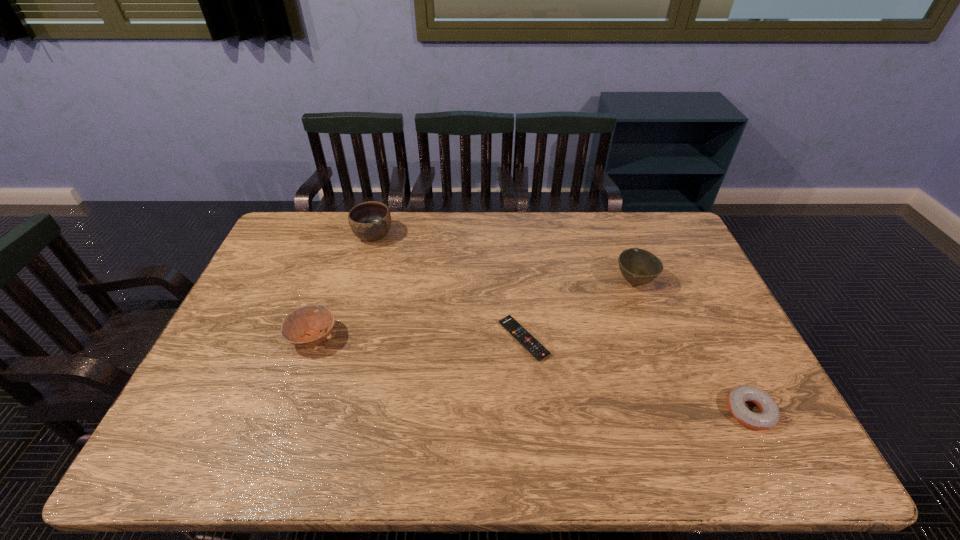
Where is `the farthest object`? This screenshot has height=540, width=960. the farthest object is located at coordinates (370, 221).

Where is `the second farthest bowl`? The width and height of the screenshot is (960, 540). the second farthest bowl is located at coordinates [x=638, y=266].

You are a GUI agent. You are given a task and a screenshot of the screen. Output one action in this format:
    pyautogui.click(x=<x>, y=<y>)
    Task: Click on the rightmost bowl
    
    Given the screenshot: What is the action you would take?
    pyautogui.click(x=638, y=266)

You are a GUI agent. You are given a task and a screenshot of the screen. Output one action in this format:
    pyautogui.click(x=<x>, y=<y>)
    Task: Click on the third tallest object
    The width and height of the screenshot is (960, 540).
    Given the screenshot: What is the action you would take?
    pyautogui.click(x=302, y=327)

The height and width of the screenshot is (540, 960). Identify the location of the nearest bowl. (302, 327).

You are a GUI agent. You are given a task and a screenshot of the screen. Output one action in this format:
    pyautogui.click(x=<x>, y=<y>)
    Task: Click on the doughnut
    This screenshot has width=960, height=540.
    Given the screenshot: What is the action you would take?
    pyautogui.click(x=769, y=416)

Find the location of `the rightmost object`. the rightmost object is located at coordinates (769, 416).

Image resolution: width=960 pixels, height=540 pixels. Find the location of `remote control`. remote control is located at coordinates (535, 348).

You are a GUI agent. You are given a task and a screenshot of the screen. Output one action in this format:
    pyautogui.click(x=<x>, y=<y>)
    Task: Click on the third object from left to right
    The width and height of the screenshot is (960, 540).
    Given the screenshot: What is the action you would take?
    pyautogui.click(x=535, y=348)

Where is `free space located 0.050m on the front of the farthest bowl`? This screenshot has width=960, height=540. free space located 0.050m on the front of the farthest bowl is located at coordinates (367, 257).